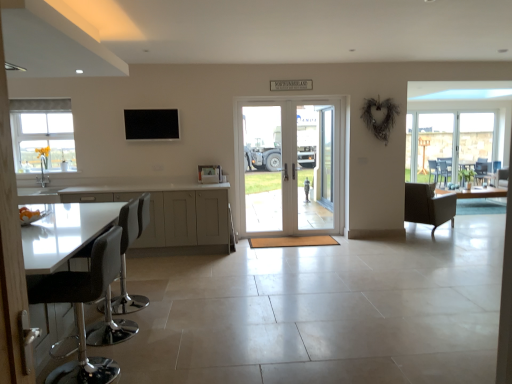
Question: Is point (253, 206) positioned closer to the camera than point (134, 190)?

Choices:
 (A) farther
 (B) closer

Answer: (A)

Question: Considering their positions, is clear glass door at center, which is the second screen door from right to left, located in front of or behind white glossy cabinets at lower left?

Choices:
 (A) front
 (B) behind

Answer: (B)

Question: Considering the real-world distances, which object is farthest from the black leather stool at lower left, arranged as the 2th chair when viewed from the left?

Choices:
 (A) clear glass door at center, the first screen door in the left-to-right sequence
 (B) black leather bar stool at left, which is counted as the second chair, starting from the front
 (C) clear glass door at center, which is counted as the 2th screen door, starting from the left
 (D) white frosted glass window at upper left
 (E) white glossy door at center

Answer: (D)

Question: Which of these objects is positioned closest to the black matte tv at upper center?

Choices:
 (A) black leather bar stool at left, which is the first chair in left-to-right order
 (B) black leather stool at lower left, the 3th chair when ordered from back to front
 (C) white frosted glass window at upper left
 (D) clear glass door at center, arranged as the 1th screen door when viewed from the right
 (E) leather-like brown chair at right, arranged as the third chair when viewed from the front

Answer: (C)